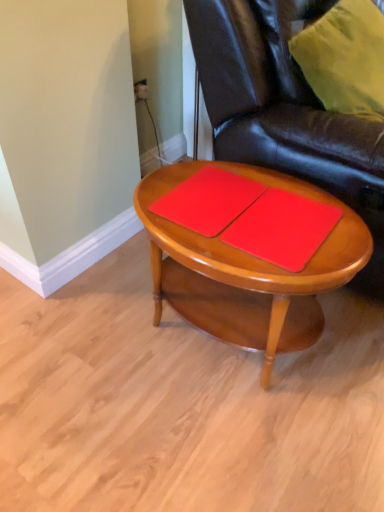
Identify the location of vacant area that is in front of red matte notebook at center, which appears as the first notebook when viewed from the right. (297, 268).